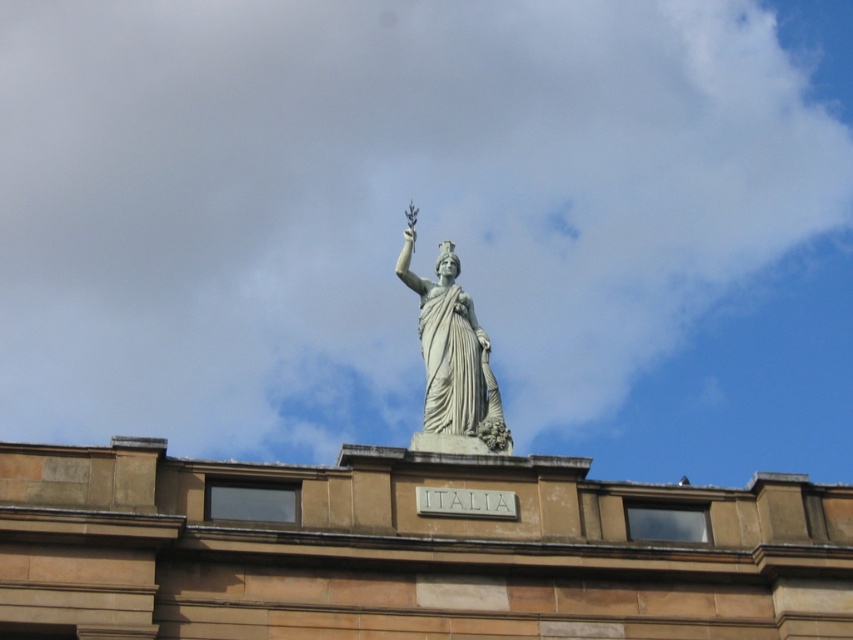
Does white fluffy cloud at upper center appear on the right side of white marble statue at center?

No, white fluffy cloud at upper center is not to the right of white marble statue at center.

Who is shorter, white fluffy cloud at upper center or white marble statue at center?

With less height is white marble statue at center.

Identify the location of white fluffy cloud at upper center. (430, 225).